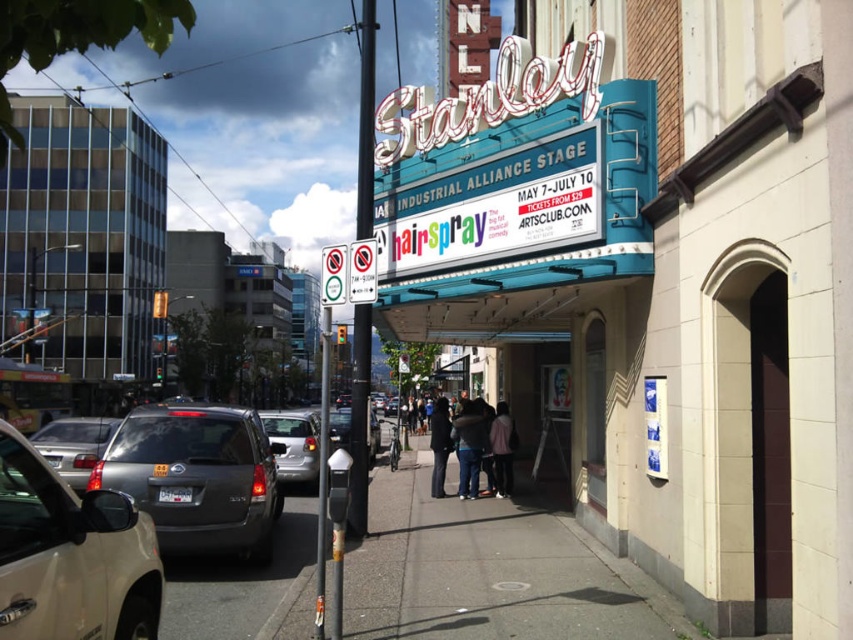
You are a pedestrian walking on the smooth concrete sidewalk at center. You notice the denim pants at center nearby. Which object is longer?

The denim pants at center are longer than the smooth concrete sidewalk at center.